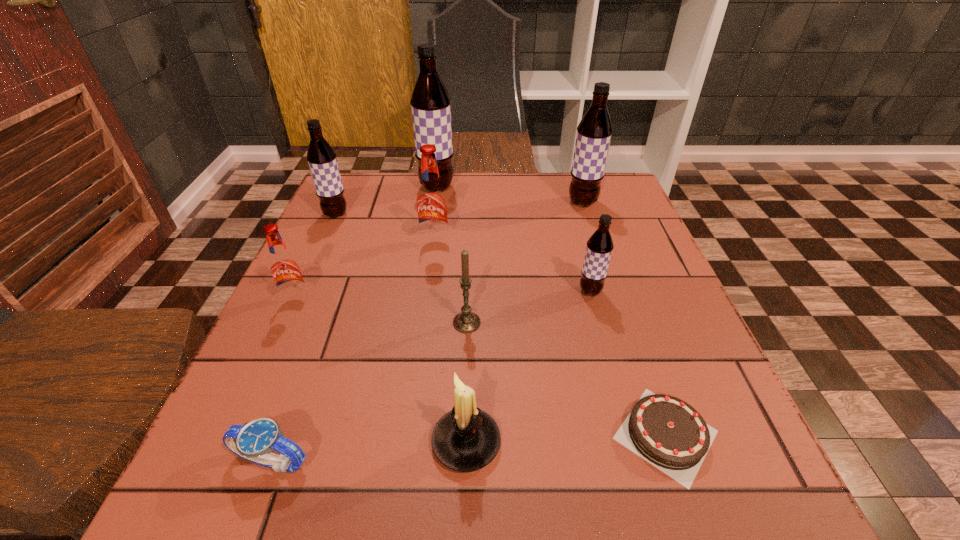
In the image, there is a desktop. At what (x,y) coordinates should I click in order to perform the action: click on vacant space at the far right corner. Please return your answer as a coordinate pair (x, y). Image resolution: width=960 pixels, height=540 pixels. Looking at the image, I should click on (618, 205).

Identify the location of vacant space at the near right corner of the desktop. (741, 519).

Where is `unoccupied area between the second biggest brown root beer and the white candle holder`? The image size is (960, 540). unoccupied area between the second biggest brown root beer and the white candle holder is located at coordinates (524, 322).

In order to click on vacant area that lies between the candle holder and the ninth shortest object in this screenshot , I will do `click(524, 322)`.

Identify the location of blank region between the watch and the smaller red root beer. The height and width of the screenshot is (540, 960). (284, 382).

At what (x,y) coordinates should I click in order to perform the action: click on unoccupied area between the biggest brown root beer and the blue watch. Please return your answer as a coordinate pair (x, y). The width and height of the screenshot is (960, 540). Looking at the image, I should click on (354, 325).

At what (x,y) coordinates should I click in order to perform the action: click on vacant area that lies between the smaller red root beer and the brown chocolate cake. Please return your answer as a coordinate pair (x, y). Looking at the image, I should click on (481, 368).

At what (x,y) coordinates should I click in order to perform the action: click on vacant space in between the shortest object and the smallest brown root beer. Please return your answer as a coordinate pair (x, y). This screenshot has width=960, height=540. Looking at the image, I should click on (628, 363).

I want to click on unoccupied position between the fifth shortest root beer and the leftmost brown root beer, so click(x=459, y=208).

You are a GUI agent. You are given a task and a screenshot of the screen. Output one action in this format:
    pyautogui.click(x=<x>, y=<y>)
    Task: Click on the empty space between the brown chocolate cake and the tallest root beer
    This screenshot has width=960, height=540.
    Given the screenshot: What is the action you would take?
    pyautogui.click(x=551, y=311)